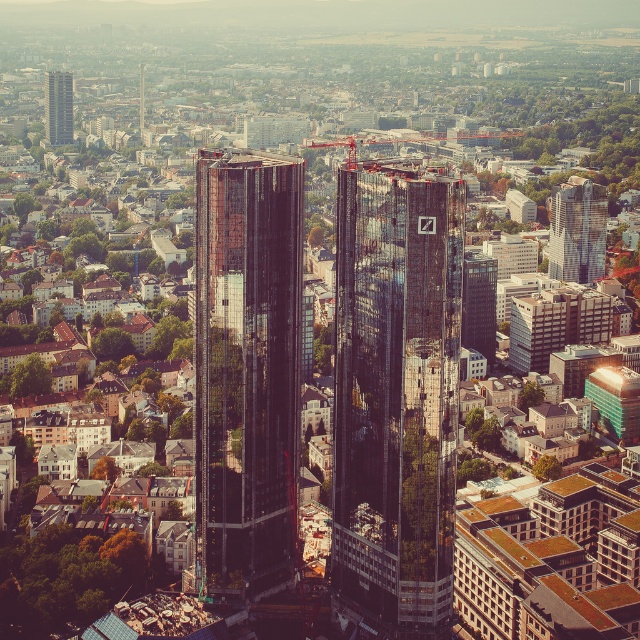
You are a city planner reviewing this urban layout. You need to determine the spatial relationship between the reflective glass skyscraper at upper right and the metallic red crane at center. Which one is positioned higher up in the image?

The reflective glass skyscraper at upper right is located below the metallic red crane at center, so the metallic red crane at center is positioned higher up in the image.

You are standing at the center of the city looking towards the horizon. There is a reflective glass skyscraper at upper right and a construction crane at lower left. Which object is closer to the point marked at coordinates [577,230]?

The reflective glass skyscraper at upper right is located at point [577,230], so it is exactly at that coordinate and therefore closer than any other object.

You are a city planner reviewing this urban layout. You need to ensure that the distance between the reflective glass skyscraper at upper right and the metallic red crane at center meets safety regulations, which require a minimum distance of 150 meters. Does the current layout comply with the regulations?

The reflective glass skyscraper at upper right is 178.13 meters away from the metallic red crane at center, which exceeds the required 150 meters, so the layout complies with safety regulations.